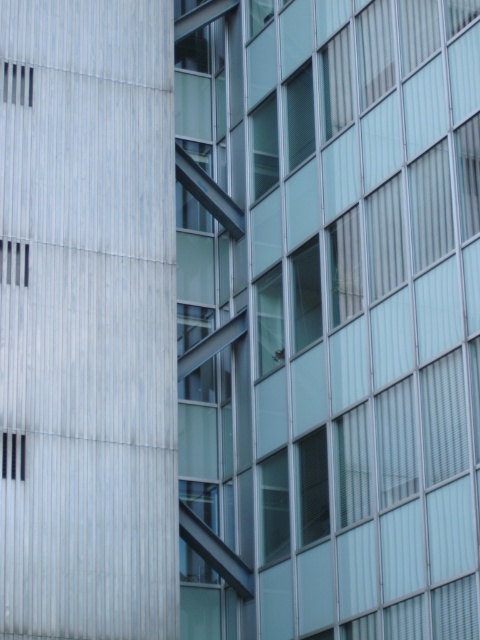
Question: Is transparent glass window at center to the right of metallic silver vent at upper left from the viewer's perspective?

Choices:
 (A) yes
 (B) no

Answer: (A)

Question: Which point is closer to the camera taking this photo?

Choices:
 (A) (406, 518)
 (B) (15, 257)

Answer: (A)

Question: Which of the following is the closest to the observer?

Choices:
 (A) metallic silver vent at upper left
 (B) transparent glass window at center

Answer: (B)

Question: Does transparent glass window at center have a larger size compared to metallic silver vent at upper left?

Choices:
 (A) no
 (B) yes

Answer: (B)

Question: Is transparent glass window at center closer to camera compared to metallic silver vent at upper left?

Choices:
 (A) yes
 (B) no

Answer: (A)